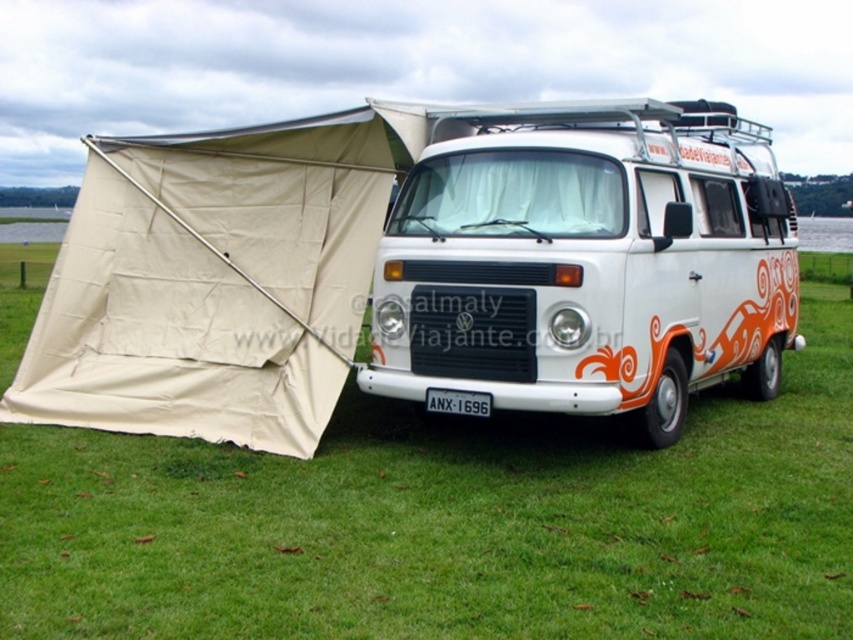
You are a photographer planning to take a closeup shot of the white plastic license plate at center and the green grass at lower center. Which object is located to the right of the license plate?

The green grass at lower center is positioned on the right side of white plastic license plate at center.

Looking at this image, you are standing at the edge of a grassy field and see the white glossy van at center. If you want to take a photo of the van from a distance of 5 meters, will you need to move closer or farther away from the van?

The white glossy van at center is currently 5.36 meters away. To achieve a 5 meter distance, you need to move closer by 0.36 meters.